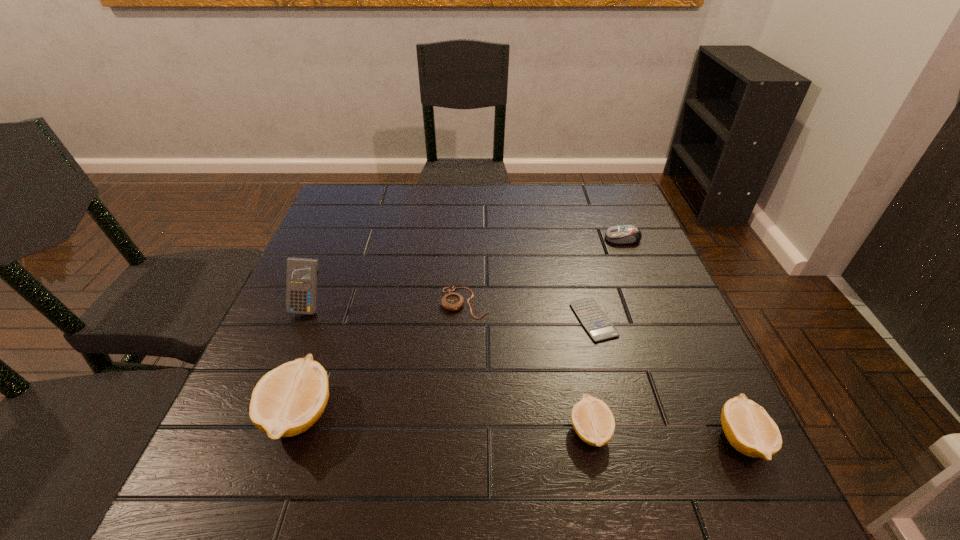
The width and height of the screenshot is (960, 540). Identify the location of the sixth tallest object. (452, 301).

Find the location of `the shorter calculator`. the shorter calculator is located at coordinates (598, 325).

At what (x,y) coordinates should I click in order to perform the action: click on the right calculator. Please return your answer as a coordinate pair (x, y). Looking at the image, I should click on (598, 325).

The height and width of the screenshot is (540, 960). I want to click on vacant space located on the back of the second tallest object, so click(x=322, y=352).

The image size is (960, 540). Identify the location of free space located 0.400m on the back of the second lemon from left to right. (557, 268).

You are a GUI agent. You are given a task and a screenshot of the screen. Output one action in this format:
    pyautogui.click(x=<x>, y=<y>)
    Task: Click on the free space located on the back of the second shortest lemon
    The height and width of the screenshot is (540, 960).
    Given the screenshot: What is the action you would take?
    pyautogui.click(x=681, y=312)

Locate an element on the screen. The image size is (960, 540). vacant region located on the front-facing side of the taller calculator is located at coordinates point(256,434).

The image size is (960, 540). Find the location of `free location located 0.050m on the wheel side of the computer mouse`. free location located 0.050m on the wheel side of the computer mouse is located at coordinates (587, 239).

Find the location of a particular element. Image resolution: width=960 pixels, height=540 pixels. vacant space located 0.200m on the wheel side of the computer mouse is located at coordinates (532, 239).

Identify the location of free space located 0.240m on the wheel side of the computer mouse. Image resolution: width=960 pixels, height=540 pixels. (517, 239).